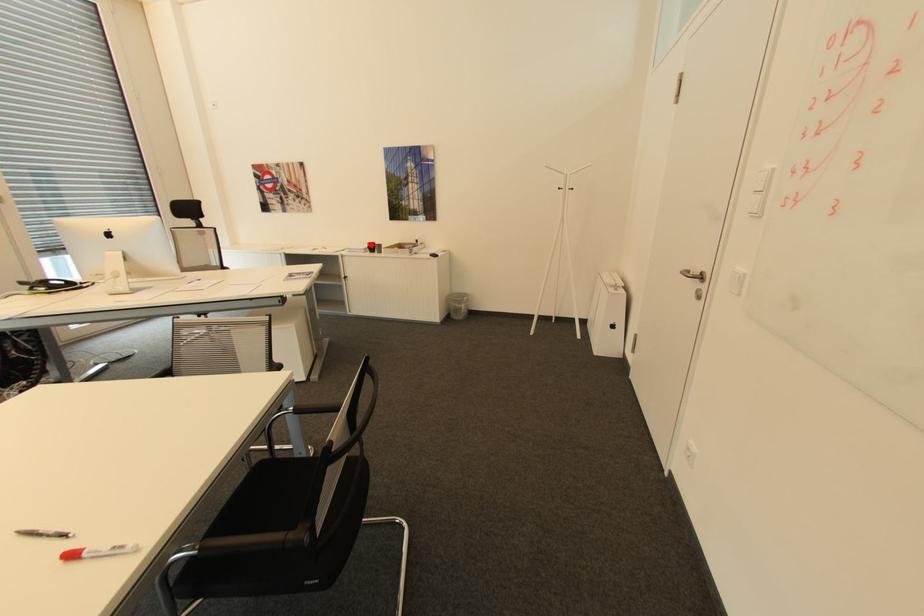
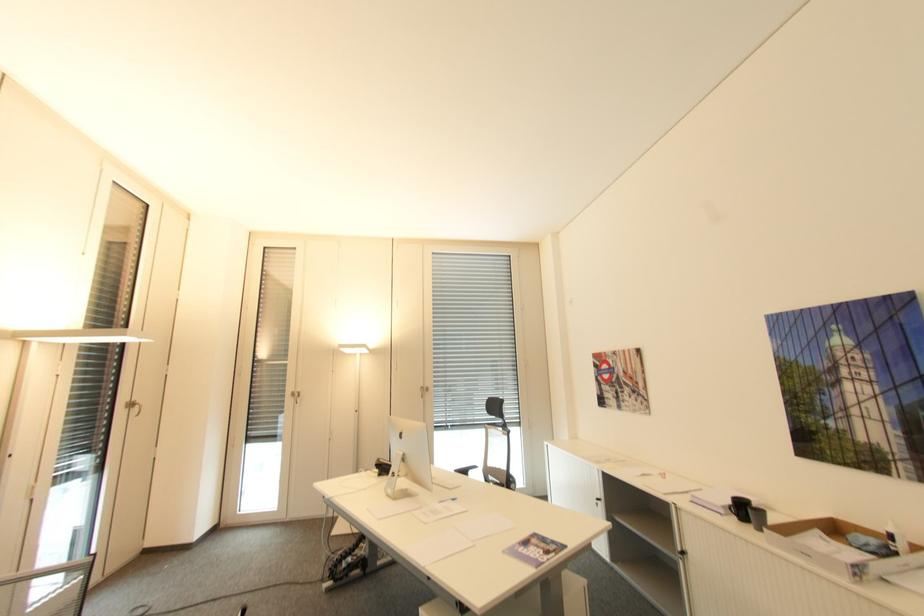
Question: I am providing you with two images of the same scene from different viewpoints. Image1 has a red point marked. In image2, the corresponding 3D location appears at what relative position? Reply with the corresponding letter.

Choices:
 (A) Closer
 (B) Farther

Answer: (B)